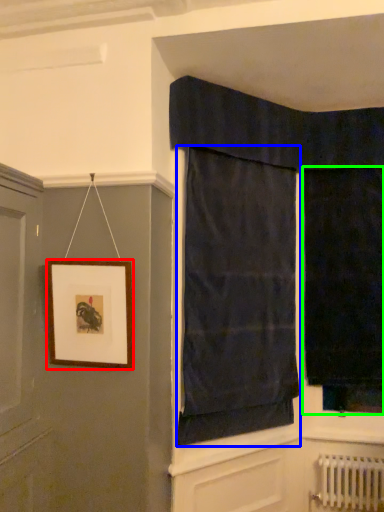
Question: Estimate the real-world distances between objects in this image. Which object is closer to picture frame (highlighted by a red box), curtain (highlighted by a blue box) or curtain (highlighted by a green box)?

Choices:
 (A) curtain
 (B) curtain

Answer: (A)